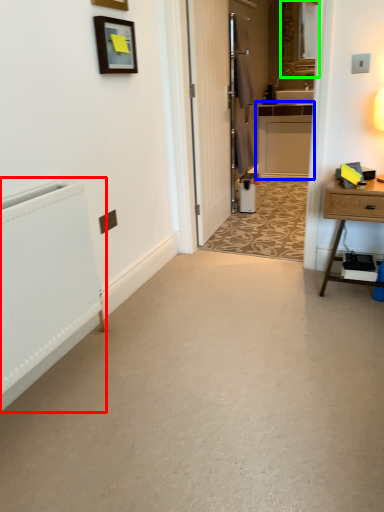
Question: Which object is positioned farthest from radiator (highlighted by a red box)? Select from cabinetry (highlighted by a blue box) and mirror (highlighted by a green box).

Choices:
 (A) cabinetry
 (B) mirror

Answer: (B)